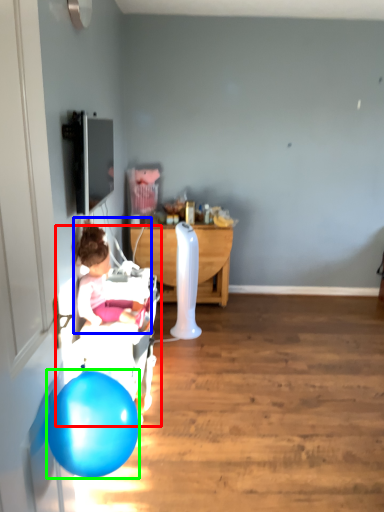
Question: Estimate the real-world distances between objects in this image. Which object is closer to baby carriage (highlighted by a red box), person (highlighted by a blue box) or balloon (highlighted by a green box)?

Choices:
 (A) person
 (B) balloon

Answer: (A)